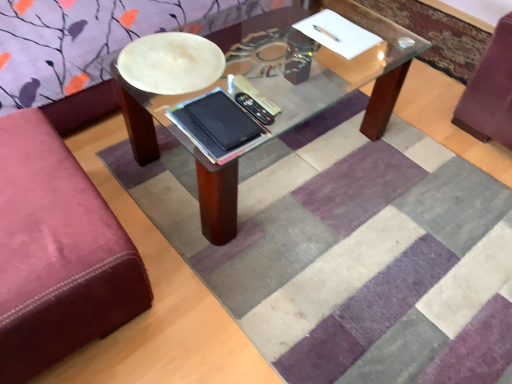
This screenshot has width=512, height=384. In order to click on free space above velvet maroon ottoman at left (from a real-world perspective) in this screenshot , I will do `click(32, 197)`.